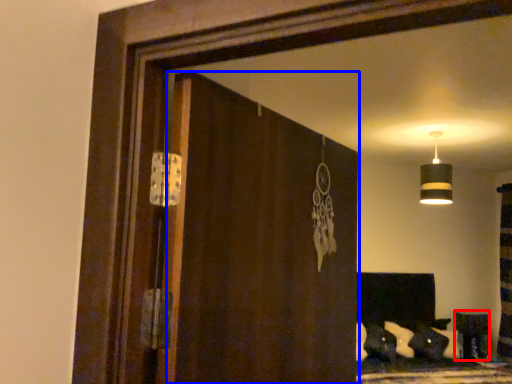
Question: Which object is further to the camera taking this photo, furniture (highlighted by a red box) or screen door (highlighted by a blue box)?

Choices:
 (A) furniture
 (B) screen door

Answer: (A)